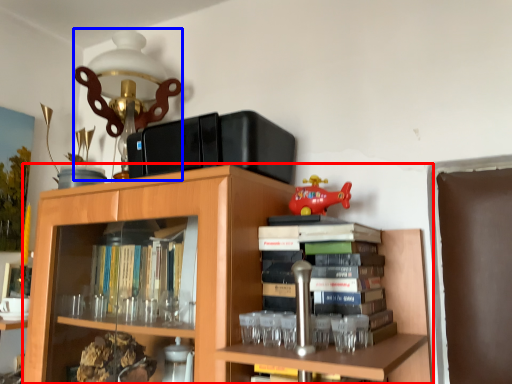
Question: Among these objects, which one is farthest to the camera, bookcase (highlighted by a red box) or table lamp (highlighted by a blue box)?

Choices:
 (A) bookcase
 (B) table lamp

Answer: (B)